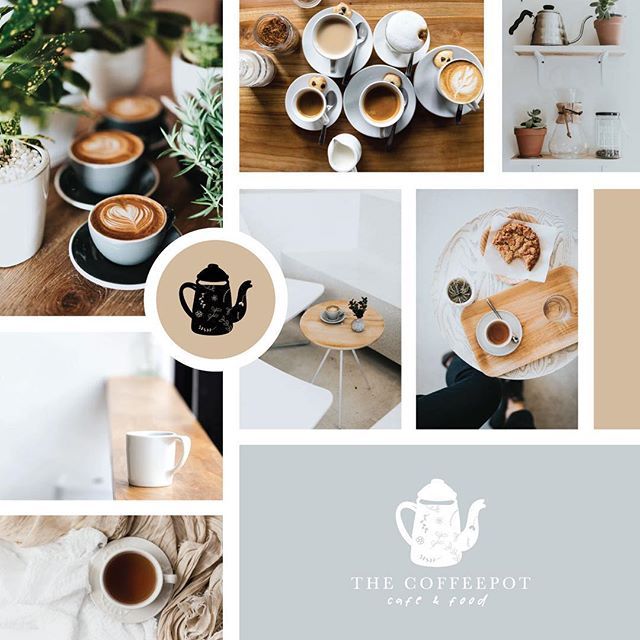
This screenshot has width=640, height=640. What are the coordinates of `potted plants` in the screenshot? It's located at (532, 125), (605, 13), (356, 308), (10, 177), (205, 64), (116, 48), (58, 114), (214, 154), (460, 289).